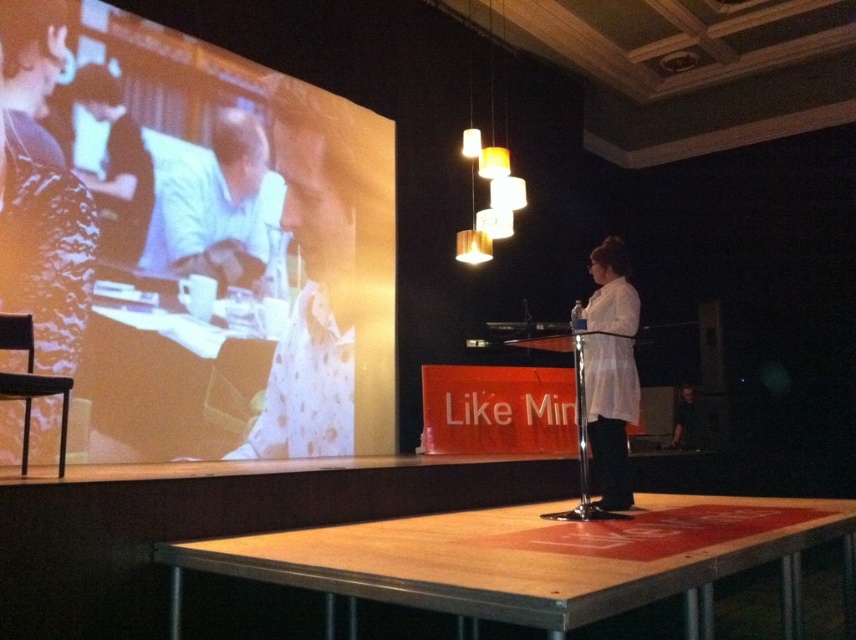
Question: Which object appears farthest from the camera in this image?

Choices:
 (A) white matte shirt at center
 (B) white glossy laptop at upper center

Answer: (B)

Question: Is white glossy laptop at upper center wider than white matte shirt at center?

Choices:
 (A) yes
 (B) no

Answer: (A)

Question: Can you confirm if white glossy laptop at upper center is positioned above white matte shirt at center?

Choices:
 (A) yes
 (B) no

Answer: (A)

Question: Does white glossy laptop at upper center have a smaller size compared to white matte shirt at center?

Choices:
 (A) yes
 (B) no

Answer: (B)